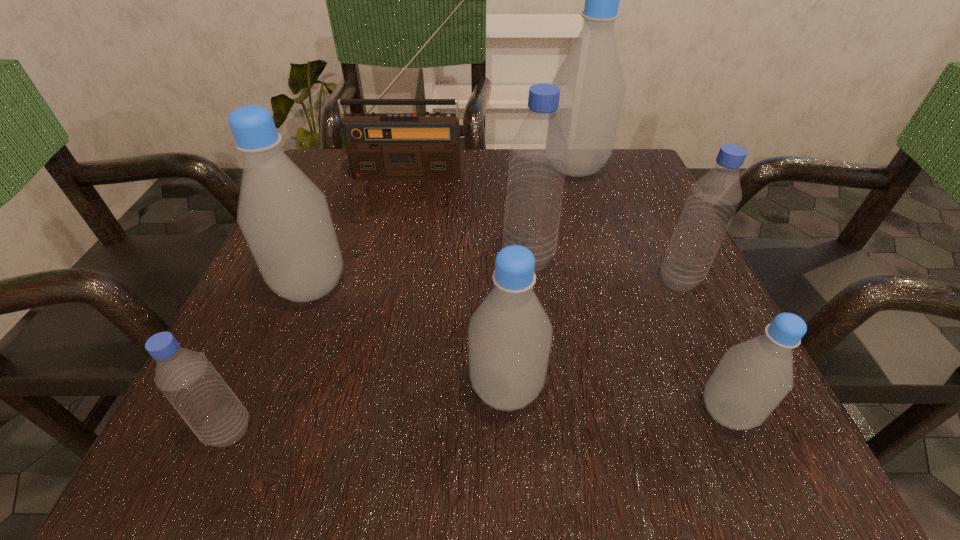
Choose which object is the seventh nearest neighbor to the third nearest gray bottle. Please provide its 2D coordinates. Your answer should be formatted as a tuple, i.e. [(x, y)], where the tuple contains the x and y coordinates of a point satisfying the conditions above.

[(752, 378)]

Identify which object is located as the nearest to the nearest blue bottle. Please provide its 2D coordinates. Your answer should be formatted as a tuple, i.e. [(x, y)], where the tuple contains the x and y coordinates of a point satisfying the conditions above.

[(285, 219)]

Point out which bottle is positioned as the fourth nearest to the leftmost blue bottle. Please provide its 2D coordinates. Your answer should be formatted as a tuple, i.e. [(x, y)], where the tuple contains the x and y coordinates of a point satisfying the conditions above.

[(752, 378)]

Identify the location of bottle that can be found as the third closest to the radio receiver. (285, 219).

Point out which gray bottle is positioned as the second nearest to the second blue bottle from left to right. Please provide its 2D coordinates. Your answer should be formatted as a tuple, i.e. [(x, y)], where the tuple contains the x and y coordinates of a point satisfying the conditions above.

[(592, 87)]

Select which gray bottle appears as the closest to the second biggest gray bottle. Please provide its 2D coordinates. Your answer should be formatted as a tuple, i.e. [(x, y)], where the tuple contains the x and y coordinates of a point satisfying the conditions above.

[(509, 336)]

Choose which blue bottle is the third nearest neighbor to the radio receiver. Please provide its 2D coordinates. Your answer should be formatted as a tuple, i.e. [(x, y)], where the tuple contains the x and y coordinates of a point satisfying the conditions above.

[(188, 380)]

Where is `blue bottle object that ranks as the closest to the nearest blue bottle`? blue bottle object that ranks as the closest to the nearest blue bottle is located at coordinates (538, 156).

The image size is (960, 540). Identify the location of vacant region that satisfies the following two spatial constraints: 1. on the front side of the smallest gray bottle; 2. on the right side of the farthest gray bottle. (648, 412).

At what (x,y) coordinates should I click in order to perform the action: click on free space in the image that satisfies the following two spatial constraints: 1. on the back side of the farthest gray bottle; 2. on the right side of the second gray bottle from left to right. Please return your answer as a coordinate pair (x, y). Looking at the image, I should click on (495, 168).